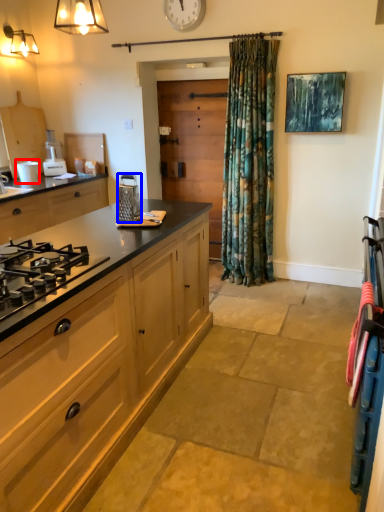
Question: Which object appears closest to the camera in this image, appliance (highlighted by a red box) or kitchen appliance (highlighted by a blue box)?

Choices:
 (A) appliance
 (B) kitchen appliance

Answer: (B)